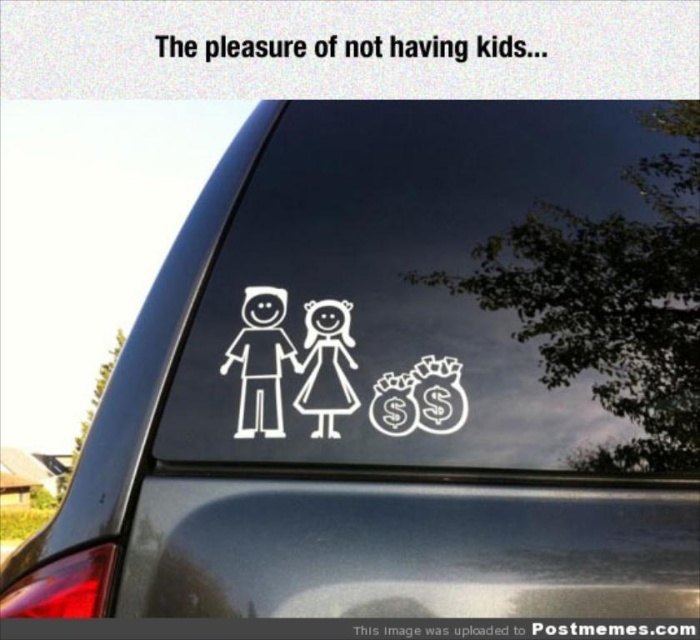
Does white paper doll at center have a greater width compared to white glossy money bags at center?

No.

Which is above, white paper doll at center or white glossy money bags at center?

white paper doll at center

Is point (340, 300) less distant than point (427, 390)?

No, it is behind (427, 390).

I want to click on white paper doll at center, so click(x=326, y=365).

Is point (183, 600) positioned in front of point (406, 400)?

Yes, it is.

Who is more distant from viewer, (651, 588) or (452, 372)?

Point (452, 372)

Who is more distant from viewer, (192,576) or (458,408)?

The point (458,408) is more distant.

Locate an element on the screen. Image resolution: width=700 pixels, height=640 pixels. transparent vinyl sticker at center is located at coordinates (410, 548).

Between white matte figure at center and white paper doll at center, which one is positioned lower?

white paper doll at center is below.

The height and width of the screenshot is (640, 700). Identify the location of white matte figure at center. (260, 362).